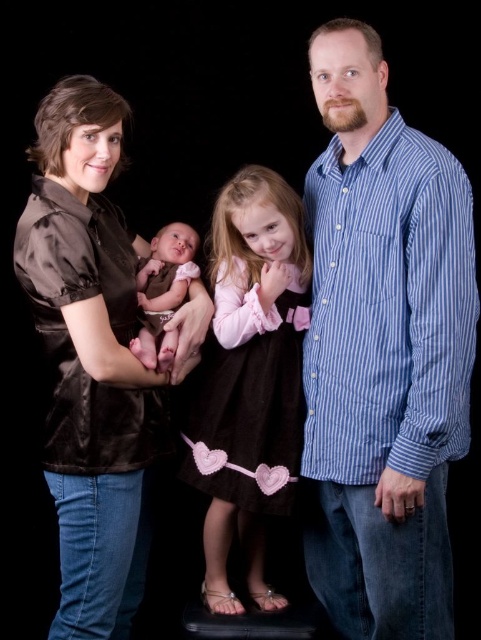
Question: Which point is farther to the camera?

Choices:
 (A) satin brown blouse at left
 (B) matte brown dress at center
 (C) smooth pink fabric at center

Answer: (B)

Question: From the image, what is the correct spatial relationship of satin brown blouse at left in relation to smooth pink fabric at center?

Choices:
 (A) right
 (B) left

Answer: (B)

Question: Which object is positioned farthest from the matte brown dress at center?

Choices:
 (A) smooth pink fabric at center
 (B) satin brown blouse at left
 (C) blue striped shirt at center

Answer: (B)

Question: Based on their relative distances, which object is farther from the matte brown dress at center?

Choices:
 (A) smooth pink fabric at center
 (B) satin brown blouse at left

Answer: (B)

Question: Does blue striped shirt at center appear under satin brown blouse at left?

Choices:
 (A) no
 (B) yes

Answer: (A)

Question: Does blue striped shirt at center appear over satin brown blouse at left?

Choices:
 (A) yes
 (B) no

Answer: (A)